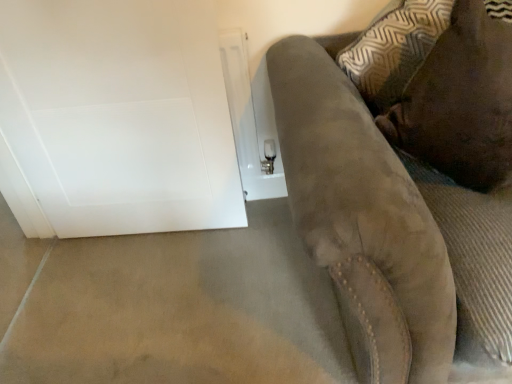
Describe the element at coordinates (119, 115) in the screenshot. The height and width of the screenshot is (384, 512). I see `white glossy door at left` at that location.

Where is `suede couch at right`? suede couch at right is located at coordinates (403, 190).

The image size is (512, 384). Describe the element at coordinates (461, 103) in the screenshot. I see `brown suede pillow at upper right` at that location.

Find the location of `white glossy door at left`. white glossy door at left is located at coordinates (119, 115).

How much distance is there between suede couch at right and brown suede pillow at upper right?

suede couch at right is 5.28 inches from brown suede pillow at upper right.

Is the depth of suede couch at right greater than that of brown suede pillow at upper right?

That is False.

Based on the photo, would you say brown suede pillow at upper right is part of suede couch at right's contents?

Yes, brown suede pillow at upper right is surrounded by suede couch at right.

From a real-world perspective, which object rests below the other?

From a 3D spatial view, suede couch at right is below.

From the image's perspective, is white glossy door at left under brown suede pillow at upper right?

Correct, white glossy door at left appears lower than brown suede pillow at upper right in the image.

Based on the photo, between white glossy door at left and brown suede pillow at upper right, which one has larger width?

brown suede pillow at upper right.

Is white glossy door at left aimed at brown suede pillow at upper right?

No, white glossy door at left is not aimed at brown suede pillow at upper right.

Considering the relative sizes of white glossy door at left and brown suede pillow at upper right in the image provided, is white glossy door at left shorter than brown suede pillow at upper right?

In fact, white glossy door at left may be taller than brown suede pillow at upper right.

From the image's perspective, between brown suede pillow at upper right and suede couch at right, which one is located above?

From the image's view, brown suede pillow at upper right is above.

Consider the image. Is brown suede pillow at upper right in front of or behind suede couch at right in the image?

In the image, brown suede pillow at upper right appears behind suede couch at right.

Is brown suede pillow at upper right wider or thinner than suede couch at right?

Clearly, brown suede pillow at upper right has less width compared to suede couch at right.

Is beige carpet at lower left at the left side of white glossy door at left?

In fact, beige carpet at lower left is to the right of white glossy door at left.

Considering the sizes of objects beige carpet at lower left and white glossy door at left in the image provided, who is bigger, beige carpet at lower left or white glossy door at left?

With larger size is white glossy door at left.

Is beige carpet at lower left completely or partially outside of white glossy door at left?

Absolutely, beige carpet at lower left is external to white glossy door at left.

This screenshot has height=384, width=512. In order to click on glass door on the left of the beige carpet at lower left in this screenshot , I will do `click(119, 115)`.

Can you confirm if beige carpet at lower left is thinner than suede couch at right?

No.

Is beige carpet at lower left shorter than suede couch at right?

Indeed, beige carpet at lower left has a lesser height compared to suede couch at right.

Does point (294, 376) come in front of point (346, 208)?

No, it is behind (346, 208).

Based on the photo, is beige carpet at lower left facing away from suede couch at right?

No.

From a real-world perspective, which object stands above the other?

In real-world perspective, brown suede pillow at upper right is above.

Is beige carpet at lower left looking in the opposite direction of brown suede pillow at upper right?

No.

Are beige carpet at lower left and brown suede pillow at upper right far apart?

That's not correct — beige carpet at lower left is a little close to brown suede pillow at upper right.

How many degrees apart are the facing directions of beige carpet at lower left and brown suede pillow at upper right?

88.2 degrees.

Considering the sizes of objects brown suede pillow at upper right and white glossy door at left in the image provided, who is smaller, brown suede pillow at upper right or white glossy door at left?

Smaller between the two is white glossy door at left.

Is brown suede pillow at upper right oriented towards white glossy door at left?

No, brown suede pillow at upper right is not oriented towards white glossy door at left.

Considering the relative positions of brown suede pillow at upper right and white glossy door at left in the image provided, is brown suede pillow at upper right to the left or to the right of white glossy door at left?

brown suede pillow at upper right is positioned on white glossy door at left's right side.

The image size is (512, 384). What are the coordinates of `furniture in front of the brown suede pillow at upper right` in the screenshot? It's located at click(403, 190).

Where is `glass door located behind the brown suede pillow at upper right`? The image size is (512, 384). glass door located behind the brown suede pillow at upper right is located at coordinates (119, 115).

Based on their spatial positions, is beige carpet at lower left or white glossy door at left further from brown suede pillow at upper right?

beige carpet at lower left.

Considering their positions, is beige carpet at lower left positioned closer to brown suede pillow at upper right than suede couch at right?

suede couch at right.

In the scene shown: Considering their positions, is beige carpet at lower left positioned further to suede couch at right than brown suede pillow at upper right?

beige carpet at lower left is further to suede couch at right.

Estimate the real-world distances between objects in this image. Which object is closer to suede couch at right, beige carpet at lower left or white glossy door at left?

Based on the image, white glossy door at left appears to be nearer to suede couch at right.

When comparing their distances from beige carpet at lower left, does brown suede pillow at upper right or white glossy door at left seem closer?

white glossy door at left is closer to beige carpet at lower left.

From the image, which object appears to be nearer to white glossy door at left, suede couch at right or beige carpet at lower left?

beige carpet at lower left is closer to white glossy door at left.

Based on their spatial positions, is beige carpet at lower left or brown suede pillow at upper right further from white glossy door at left?

brown suede pillow at upper right.

Based on their spatial positions, is white glossy door at left or brown suede pillow at upper right further from suede couch at right?

Among the two, white glossy door at left is located further to suede couch at right.

At what (x,y) coordinates should I click in order to perform the action: click on pillow situated between white glossy door at left and suede couch at right from left to right. Please return your answer as a coordinate pair (x, y). The height and width of the screenshot is (384, 512). Looking at the image, I should click on 461,103.

At what (x,y) coordinates should I click in order to perform the action: click on concrete situated between white glossy door at left and brown suede pillow at upper right from left to right. Please return your answer as a coordinate pair (x, y). This screenshot has height=384, width=512. Looking at the image, I should click on (169, 307).

Locate an element on the screen. pillow situated between beige carpet at lower left and suede couch at right from left to right is located at coordinates (461, 103).

At what (x,y) coordinates should I click in order to perform the action: click on concrete located between white glossy door at left and suede couch at right in the left-right direction. Please return your answer as a coordinate pair (x, y). The height and width of the screenshot is (384, 512). Looking at the image, I should click on (169, 307).